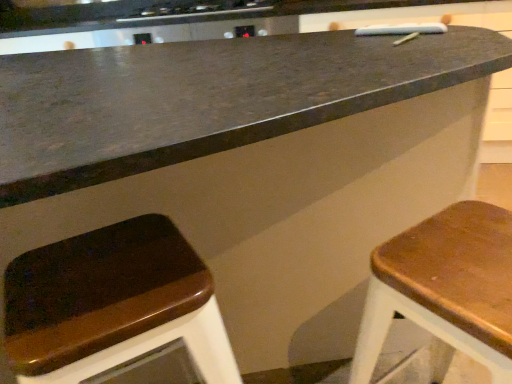
Question: Would you say black glass stove at upper center is to the left or to the right of wooden seat at right, arranged as the 1th stool when viewed from the right, in the picture?

Choices:
 (A) right
 (B) left

Answer: (B)

Question: In terms of size, does black glass stove at upper center appear bigger or smaller than wooden seat at right, arranged as the 1th stool when viewed from the right?

Choices:
 (A) small
 (B) big

Answer: (A)

Question: Estimate the real-world distances between objects in this image. Which object is farther from the wooden seat at right, arranged as the 1th stool when viewed from the right?

Choices:
 (A) wooden seat at lower left, the 2th stool positioned from the right
 (B) black glass stove at upper center

Answer: (B)

Question: Which of these objects is positioned farthest from the black glass stove at upper center?

Choices:
 (A) wooden seat at right, arranged as the 1th stool when viewed from the right
 (B) wooden seat at lower left, the 1th stool viewed from the left

Answer: (A)